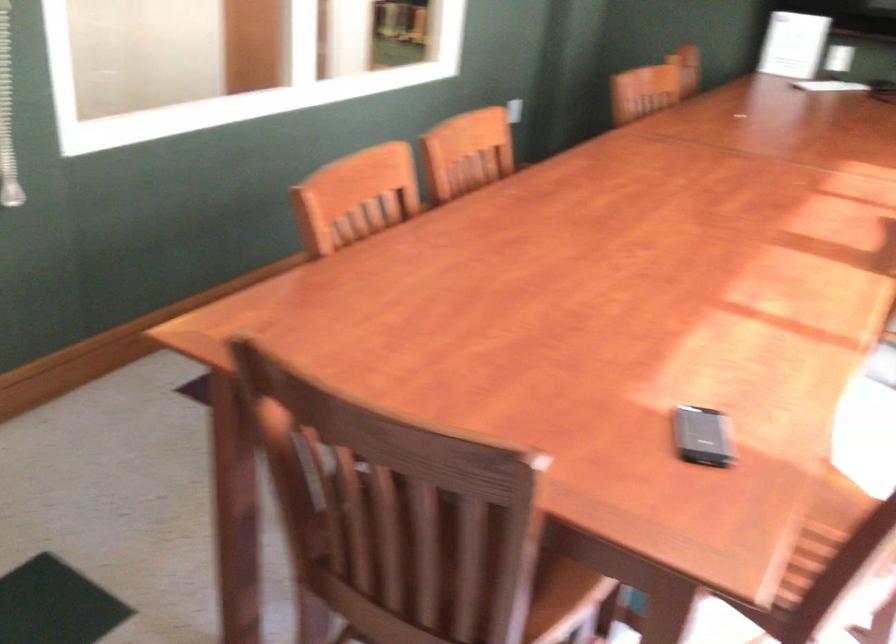
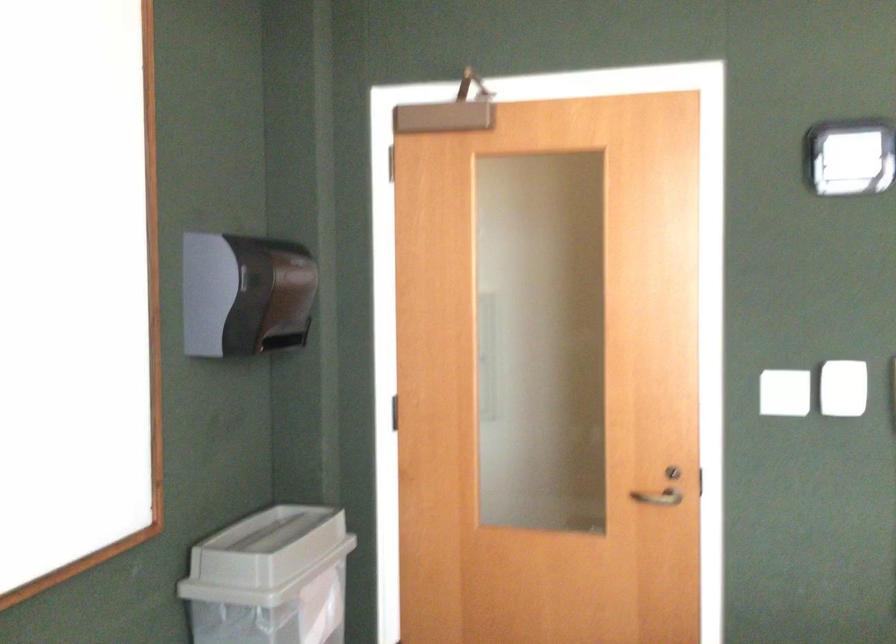
Question: The first image is from the beginning of the video and the second image is from the end. How did the camera likely rotate when shooting the video?

Choices:
 (A) Left
 (B) Right
 (C) Up
 (D) Down

Answer: (A)